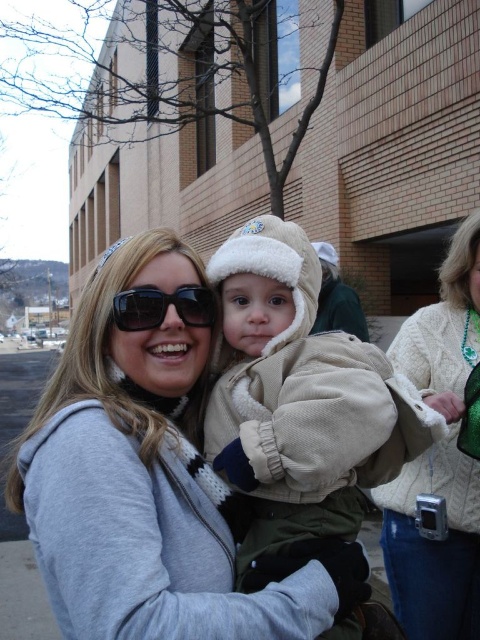
You are standing in the cold day scene and want to know where the point at coordinate (x=147, y=481) is located. According to the scene description, can you determine which object the point is on?

The point at coordinate (x=147, y=481) is located on the matte gray hoodie at center.

You are a fashion designer analyzing this winter outfit. You notice the matte gray hoodie at center and the ivory cable knit sweater at lower right. Which piece of clothing is positioned higher on the body?

The matte gray hoodie at center is positioned higher on the body than the ivory cable knit sweater at lower right because it is described as being above it.

You are a photographer setting up for a winter photoshoot. You have two items to arrange in the scene according to the image provided. The matte gray hoodie at center and the ivory cable knit sweater at lower right. The distance between them needs to be exactly 5 feet. Currently, they are 4.50 feet apart. What adjustment should you make to meet the requirement?

The matte gray hoodie at center is currently 4.50 feet from the ivory cable knit sweater at lower right. To meet the 5 feet requirement, move them slightly apart by 0.50 feet.